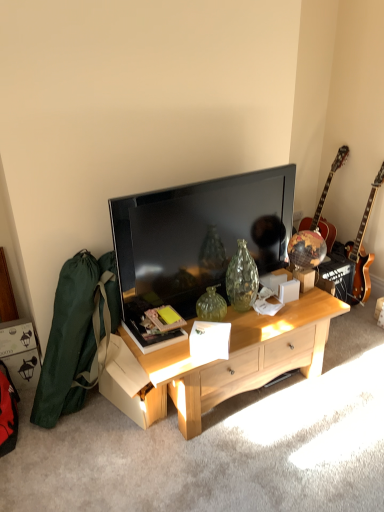
Question: Considering the relative sizes of wooden acoustic guitar at right, the 2th guitar in the right-to-left sequence, and glossy wood guitar at right, the second guitar positioned from the left, in the image provided, is wooden acoustic guitar at right, the 2th guitar in the right-to-left sequence, wider than glossy wood guitar at right, the second guitar positioned from the left,?

Choices:
 (A) yes
 (B) no

Answer: (A)

Question: Does wooden acoustic guitar at right, which is counted as the 1th guitar, starting from the left, have a lesser height compared to glossy wood guitar at right, the first guitar positioned from the right?

Choices:
 (A) no
 (B) yes

Answer: (B)

Question: Does wooden acoustic guitar at right, the 2th guitar in the right-to-left sequence, have a smaller size compared to glossy wood guitar at right, the first guitar positioned from the right?

Choices:
 (A) no
 (B) yes

Answer: (A)

Question: Is wooden acoustic guitar at right, the 2th guitar in the right-to-left sequence, closer to camera compared to glossy wood guitar at right, the first guitar positioned from the right?

Choices:
 (A) yes
 (B) no

Answer: (B)

Question: Is wooden acoustic guitar at right, the 2th guitar in the right-to-left sequence, to the right of glossy wood guitar at right, the second guitar positioned from the left, from the viewer's perspective?

Choices:
 (A) yes
 (B) no

Answer: (B)

Question: Is wooden acoustic guitar at right, which is counted as the 1th guitar, starting from the left, behind glossy wood guitar at right, the second guitar positioned from the left?

Choices:
 (A) yes
 (B) no

Answer: (A)

Question: Can you confirm if glossy wood guitar at right, the second guitar positioned from the left, is smaller than light wood cabinet at center?

Choices:
 (A) no
 (B) yes

Answer: (B)

Question: From the image's perspective, is glossy wood guitar at right, the second guitar positioned from the left, over light wood cabinet at center?

Choices:
 (A) no
 (B) yes

Answer: (B)

Question: Is glossy wood guitar at right, the first guitar positioned from the right, facing towards light wood cabinet at center?

Choices:
 (A) no
 (B) yes

Answer: (B)

Question: From a real-world perspective, is glossy wood guitar at right, the first guitar positioned from the right, located higher than light wood cabinet at center?

Choices:
 (A) yes
 (B) no

Answer: (A)

Question: Is glossy wood guitar at right, the second guitar positioned from the left, to the right of light wood cabinet at center from the viewer's perspective?

Choices:
 (A) no
 (B) yes

Answer: (B)

Question: From a real-world perspective, does glossy wood guitar at right, the second guitar positioned from the left, sit lower than light wood cabinet at center?

Choices:
 (A) no
 (B) yes

Answer: (A)

Question: Can you confirm if matte black tv at center is bigger than light wood cabinet at center?

Choices:
 (A) yes
 (B) no

Answer: (B)